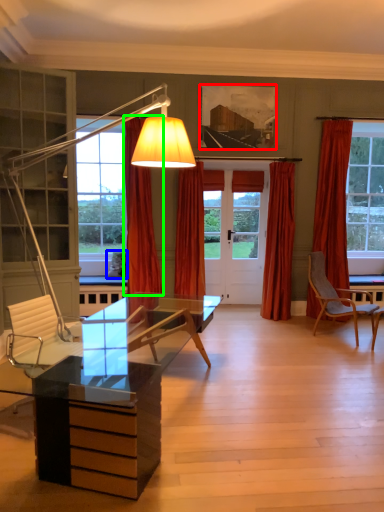
Question: Which object is the farthest from picture frame (highlighted by a red box)? Choose among these: pillow (highlighted by a blue box) or curtain (highlighted by a green box).

Choices:
 (A) pillow
 (B) curtain

Answer: (A)